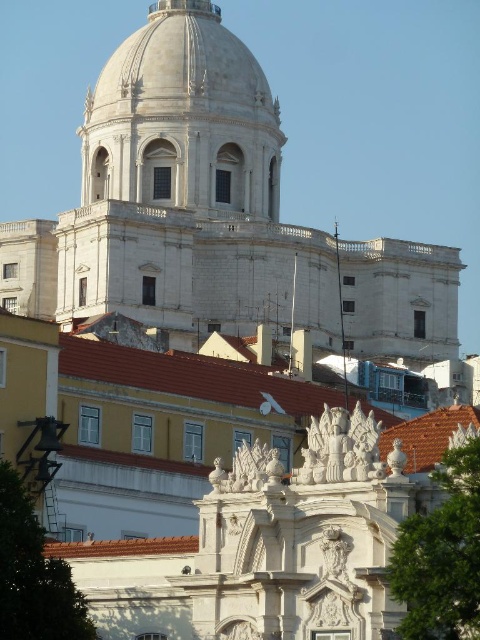
Question: Considering the real-world distances, which object is closest to the white marble dome at upper center?

Choices:
 (A) green leafy tree at center
 (B) green leafy tree at lower left

Answer: (B)

Question: Which point appears farthest from the camera in this image?

Choices:
 (A) (227, 205)
 (B) (425, 621)
 (C) (72, 611)

Answer: (A)

Question: Does white marble dome at upper center have a smaller size compared to green leafy tree at center?

Choices:
 (A) yes
 (B) no

Answer: (B)

Question: Does green leafy tree at center lie in front of green leafy tree at lower left?

Choices:
 (A) yes
 (B) no

Answer: (A)

Question: Which point appears farthest from the camera in this image?

Choices:
 (A) (433, 612)
 (B) (8, 541)

Answer: (B)

Question: Is white marble dome at upper center below green leafy tree at center?

Choices:
 (A) yes
 (B) no

Answer: (B)